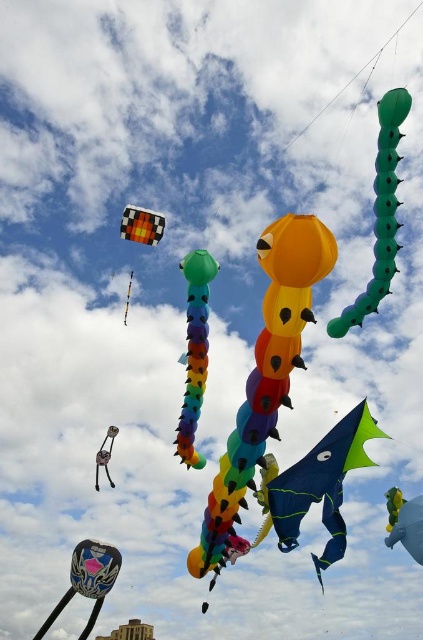
You are standing in a field and see two points in the sky where kites are flying. The first point is at coordinates point (387, 96) and the second is at point (414, 513). Which point is closer to you?

Point (387, 96) is closer to the viewer than point (414, 513).